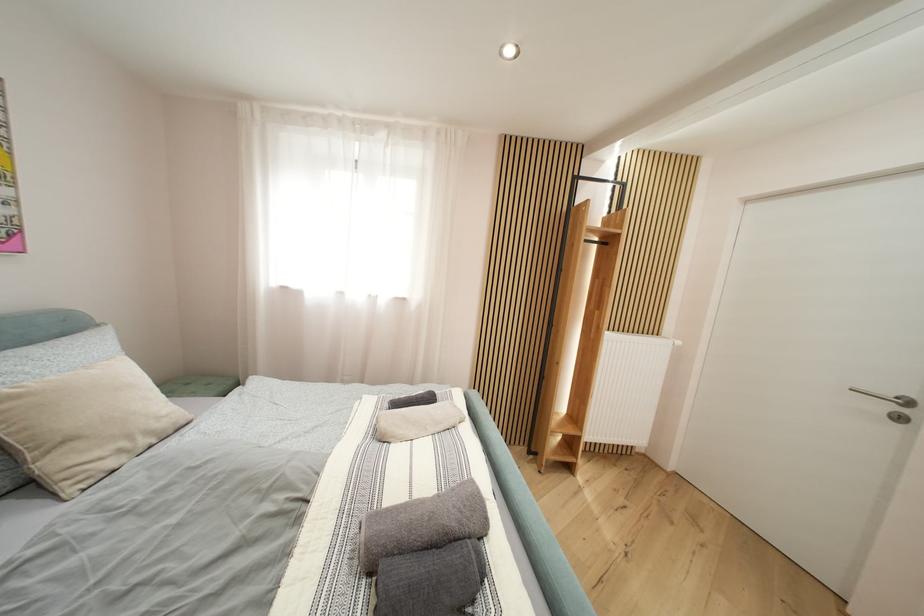
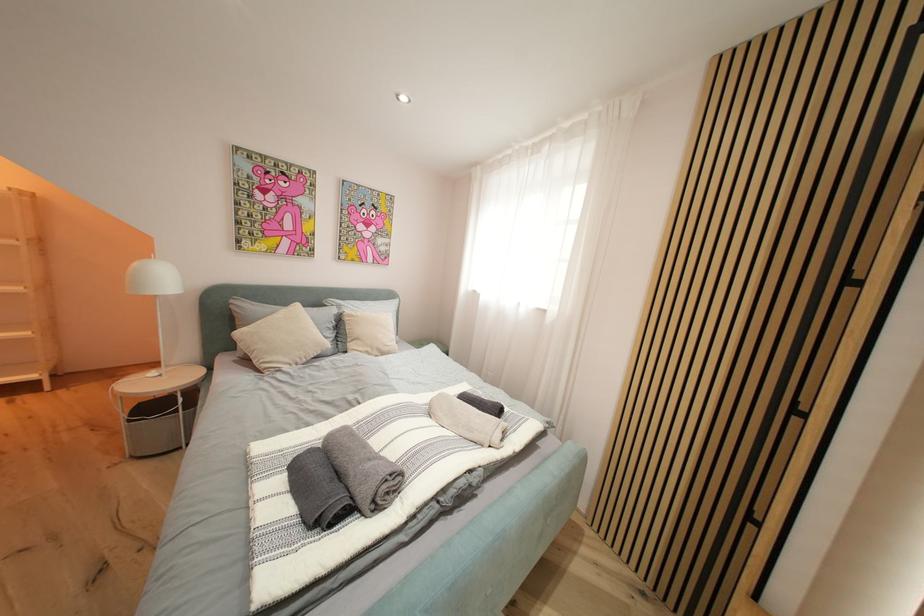
Question: Based on the continuous images, in which direction is the camera rotating? Reply with the corresponding letter.

Choices:
 (A) Left
 (B) Right
 (C) Up
 (D) Down

Answer: (A)